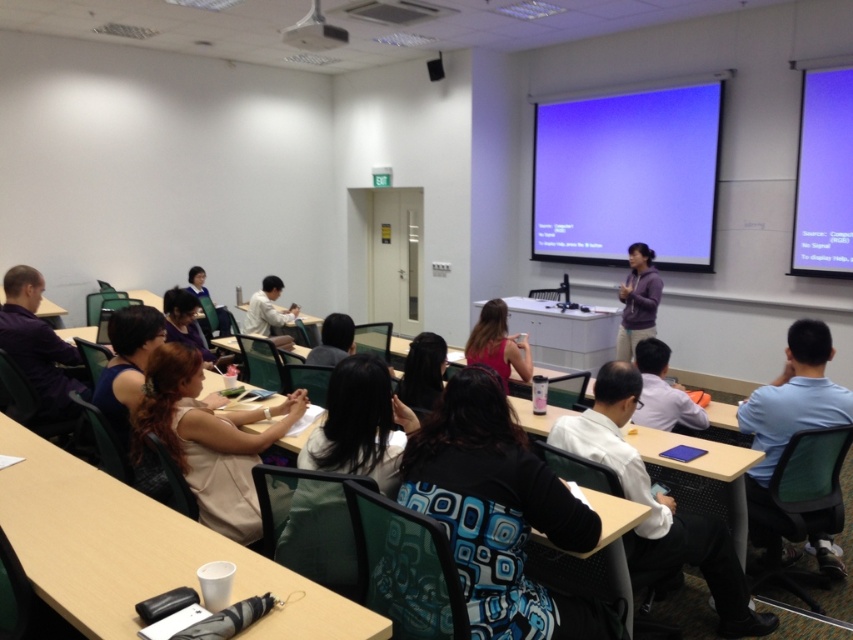
You are a student sitting at the back of the classroom. You notice two items in the image, the purple matte sweater at center and the black plastic projector at upper center. Which item do you think is larger in size?

The purple matte sweater at center is bigger than the black plastic projector at upper center, so the purple matte sweater at center is larger in size.

You are a student sitting in the classroom and need to refer to the blue matte projection screen at upper center during the lecture. However, you notice the white shirt at center of the person in front of you is blocking your view. Can you see the projection screen clearly?

The blue matte projection screen at upper center is larger than the white shirt at center, so you can still see the projection screen clearly despite the obstruction.

Based on the scene description, where is the white plastic table at lower center located in terms of coordinates?

The white plastic table at lower center is located at coordinates point [140,552].